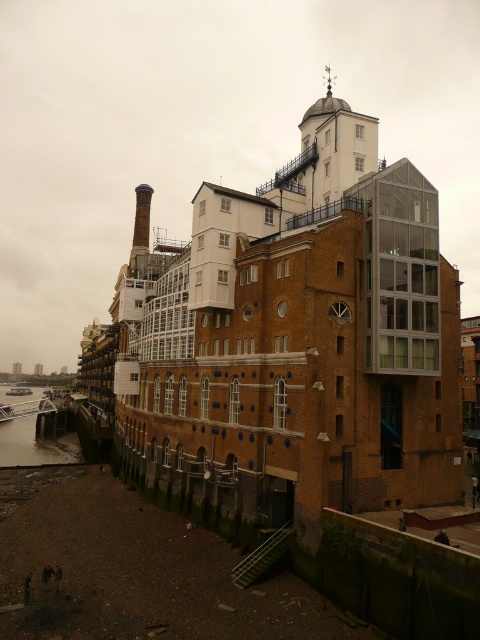
Question: Does greenish water at lower left have a greater width compared to red brick chimney at center-left?

Choices:
 (A) yes
 (B) no

Answer: (A)

Question: Can you confirm if brown brick building at center is positioned below greenish water at lower left?

Choices:
 (A) yes
 (B) no

Answer: (B)

Question: Which point is farther from the camera taking this photo?

Choices:
 (A) (437, 291)
 (B) (39, 388)
 (C) (144, 204)

Answer: (B)

Question: Which of the following is the farthest from the observer?

Choices:
 (A) brown brick building at center
 (B) greenish water at lower left
 (C) red brick chimney at center-left

Answer: (B)

Question: Does brown brick building at center have a larger size compared to red brick chimney at center-left?

Choices:
 (A) no
 (B) yes

Answer: (B)

Question: Based on their relative distances, which object is nearer to the brown brick building at center?

Choices:
 (A) red brick chimney at center-left
 (B) greenish water at lower left

Answer: (A)